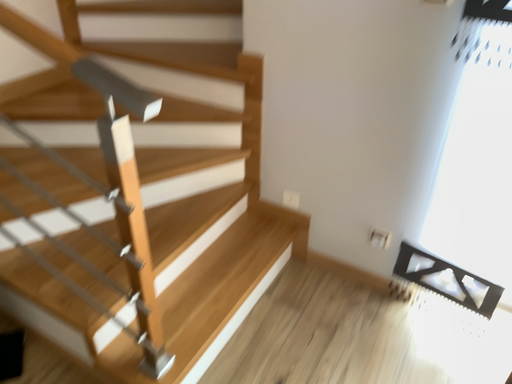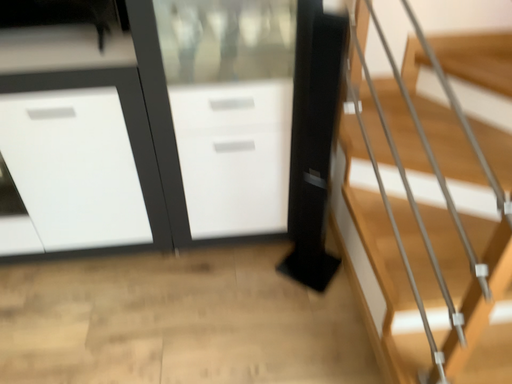
Question: Which way did the camera rotate in the video?

Choices:
 (A) rotated left
 (B) rotated right

Answer: (A)